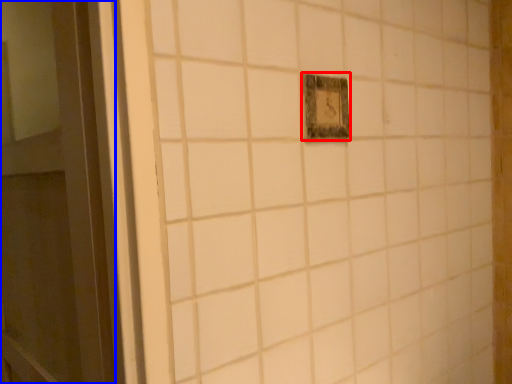
Question: Which object appears closest to the camera in this image, light switch (highlighted by a red box) or door (highlighted by a blue box)?

Choices:
 (A) light switch
 (B) door

Answer: (B)